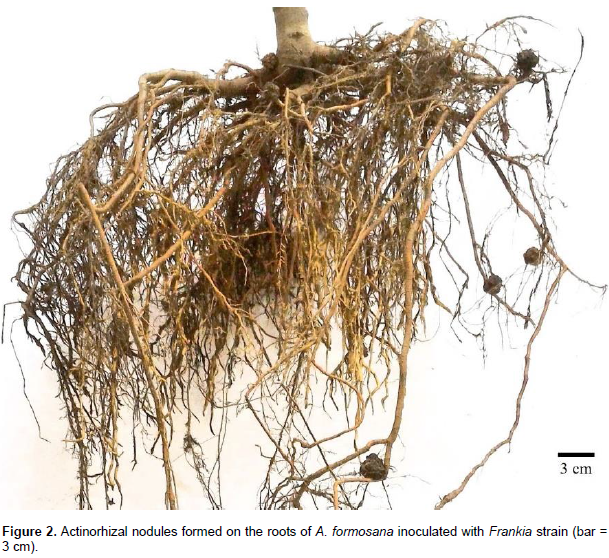
Where is `plant`? The height and width of the screenshot is (558, 609). plant is located at coordinates [300, 235].